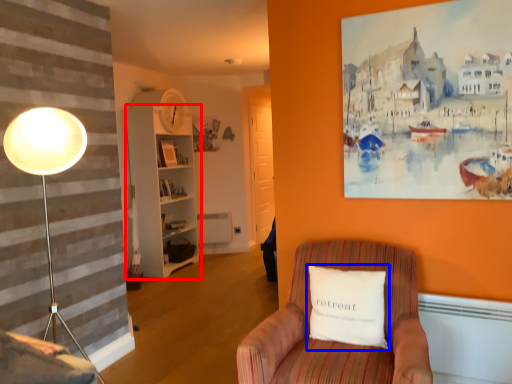
Question: Which object is further to the camera taking this photo, bookshelf (highlighted by a red box) or pillow (highlighted by a blue box)?

Choices:
 (A) bookshelf
 (B) pillow

Answer: (A)